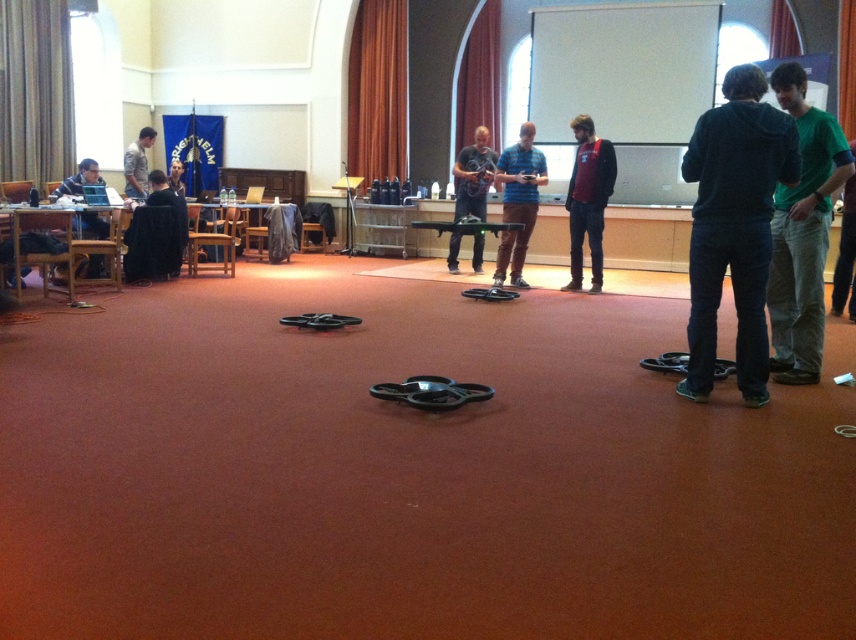
Between green cotton shirt at right and matte black drone at center, which one is positioned higher?

matte black drone at center is above.

Is point (810, 196) closer to viewer compared to point (482, 161)?

Yes.

The width and height of the screenshot is (856, 640). I want to click on green cotton shirt at right, so click(x=801, y=232).

Does point (610, 176) come in front of point (513, 211)?

Yes, point (610, 176) is in front of point (513, 211).

What are the coordinates of `red matte jacket at center` in the screenshot? It's located at (587, 198).

Which is in front, point (581, 125) or point (525, 202)?

Positioned in front is point (581, 125).

You are a GUI agent. You are given a task and a screenshot of the screen. Output one action in this format:
    pyautogui.click(x=<x>, y=<y>)
    Task: Click on the red matte jacket at center
    The height and width of the screenshot is (640, 856).
    Given the screenshot: What is the action you would take?
    pyautogui.click(x=587, y=198)

Between matte black laptop at left and camouflage shirt at left, which one has less height?

matte black laptop at left is shorter.

Does point (76, 177) come closer to viewer compared to point (129, 144)?

Yes, point (76, 177) is in front of point (129, 144).

Is point (67, 179) positioned before point (141, 180)?

Yes, it is in front of point (141, 180).

I want to click on matte black laptop at left, so point(79,179).